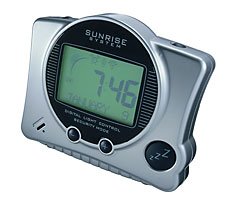
The height and width of the screenshot is (200, 250). Find the location of `speaker`. speaker is located at coordinates pos(50,67), pos(151,96).